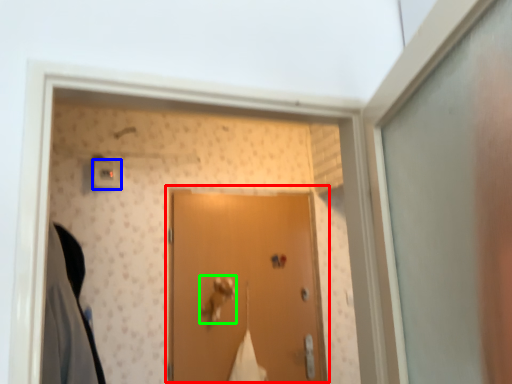
Question: Which is farther away from door (highlighted by a red box)? light switch (highlighted by a blue box) or door handle (highlighted by a green box)?

Choices:
 (A) light switch
 (B) door handle

Answer: (A)